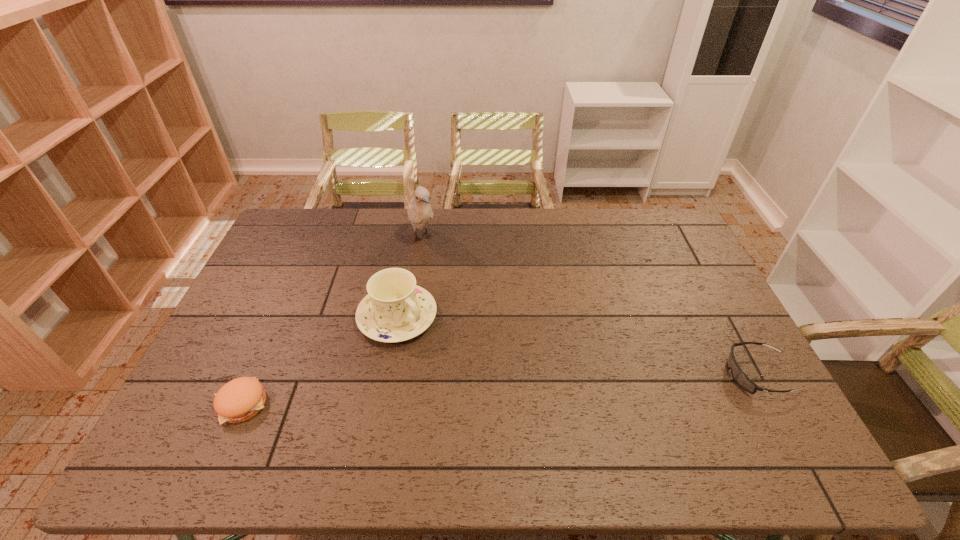
Find the location of a particular element. This screenshot has width=960, height=540. vacant spot on the desktop that is between the leftmost object and the rightmost object and is positioned at the beak of the farthest object is located at coordinates (518, 388).

You are a GUI agent. You are given a task and a screenshot of the screen. Output one action in this format:
    pyautogui.click(x=<x>, y=<y>)
    Task: Click on the vacant space on the desktop that is between the leftmost object and the rightmost object and is positioned on the handle side of the second farthest object
    This screenshot has height=540, width=960.
    Given the screenshot: What is the action you would take?
    pyautogui.click(x=487, y=390)